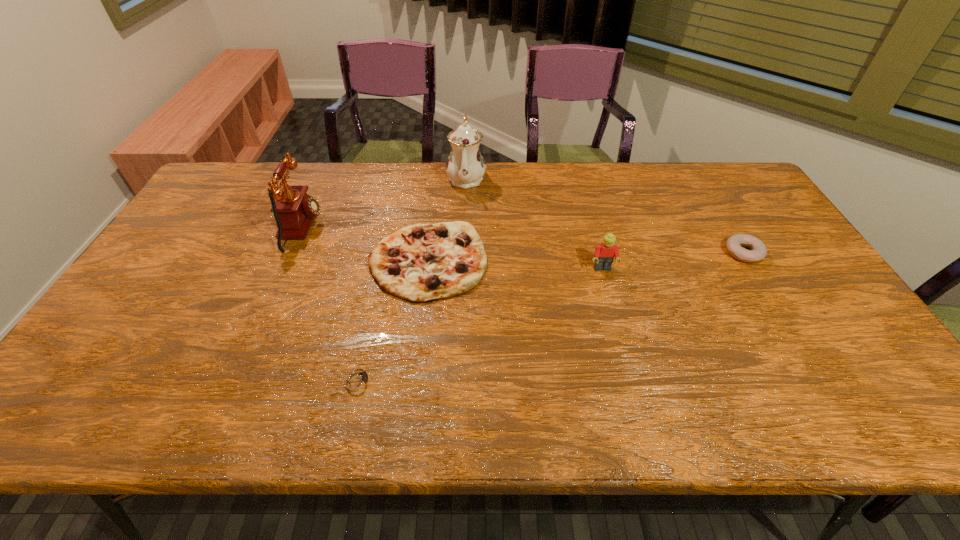
Identify the location of vacant space located on the face of the Lego. The image size is (960, 540). (627, 356).

Where is `vacant area located on the left of the pizza`? The width and height of the screenshot is (960, 540). vacant area located on the left of the pizza is located at coordinates (352, 261).

Locate an element on the screen. The image size is (960, 540). vacant space situated 0.330m on the back of the rightmost object is located at coordinates (698, 178).

Find the location of a particular element. The image size is (960, 540). free spot located on the face of the watch is located at coordinates (541, 380).

At what (x,y) coordinates should I click in order to perform the action: click on object present at the far edge. Please return your answer as a coordinate pair (x, y). Looking at the image, I should click on (465, 166).

Locate an element on the screen. This screenshot has width=960, height=540. object that is at the near edge is located at coordinates (357, 380).

Locate an element on the screen. The height and width of the screenshot is (540, 960). object that is at the right edge is located at coordinates (758, 251).

This screenshot has height=540, width=960. Identify the location of vacant region at the far edge of the desktop. 602,163.

In the image, there is a desktop. What are the coordinates of `vacant space at the near edge` in the screenshot? It's located at (276, 405).

Locate an element on the screen. The width and height of the screenshot is (960, 540). free space at the left edge of the desktop is located at coordinates (82, 386).